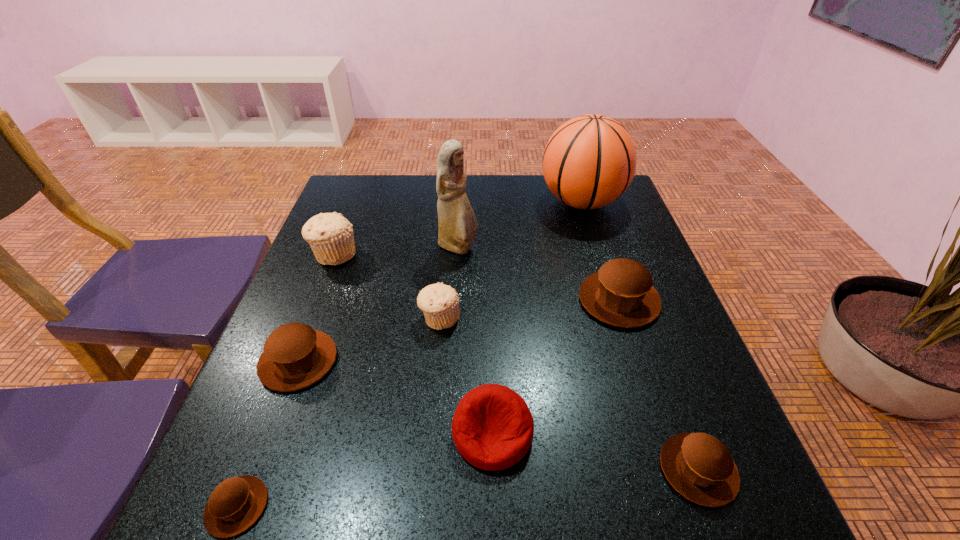
Where is `figurine`? This screenshot has height=540, width=960. figurine is located at coordinates (457, 224).

Locate an element on the screen. Image resolution: width=960 pixels, height=540 pixels. the farthest object is located at coordinates (589, 161).

The image size is (960, 540). I want to click on orange basketball, so click(589, 161).

Where is `the left beige muffin`? the left beige muffin is located at coordinates (330, 235).

Locate an element on the screen. the farthest muffin is located at coordinates (330, 235).

Locate an element on the screen. The height and width of the screenshot is (540, 960). the biggest brown muffin is located at coordinates (621, 293).

At what (x,y) coordinates should I click in order to perform the action: click on the nearer beige muffin. Please return your answer as a coordinate pair (x, y). The image size is (960, 540). Looking at the image, I should click on 440,303.

Find the location of a particular element. The width and height of the screenshot is (960, 540). the third muffin from right to left is located at coordinates (440, 303).

Find the location of a particular element. The image size is (960, 540). the second biggest brown muffin is located at coordinates (295, 356).

What are the coordinates of `beanbag` in the screenshot? It's located at (493, 428).